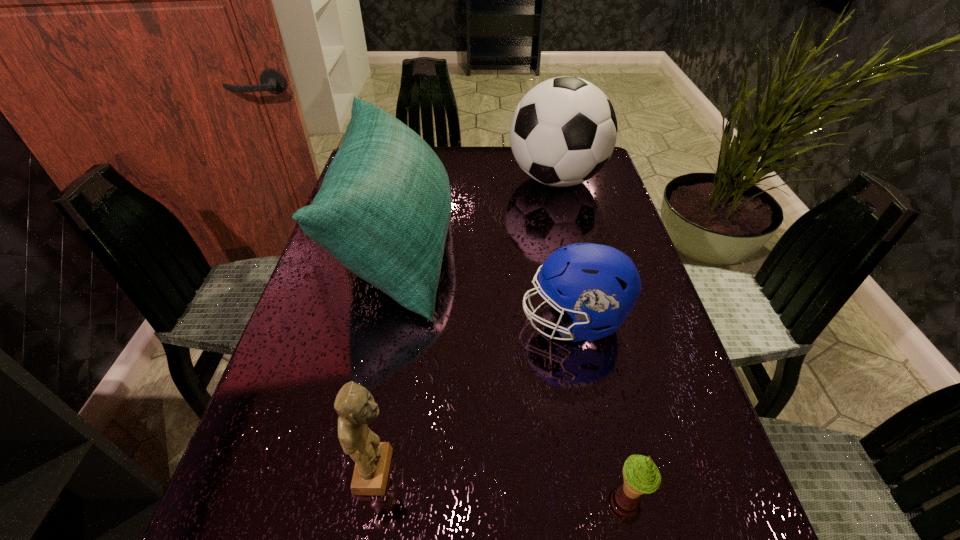
Find the location of a particular element. soccer ball is located at coordinates (x=563, y=132).

Image resolution: width=960 pixels, height=540 pixels. What are the coordinates of `cushion` in the screenshot? It's located at (383, 210).

Locate an element on the screen. figurine is located at coordinates (355, 405).

You are a GUI agent. You are given a task and a screenshot of the screen. Output one action in this format:
    pyautogui.click(x=<x>, y=<y>)
    Task: Click on the football helmet
    Image resolution: width=960 pixels, height=540 pixels.
    Given the screenshot: What is the action you would take?
    pyautogui.click(x=597, y=285)

Locate an element on the screen. icecream is located at coordinates (641, 476).

This screenshot has width=960, height=540. I want to click on vacant space located 0.280m on the left of the soccer ball, so click(x=416, y=179).

This screenshot has width=960, height=540. Find the location of `free spot located on the front-facing side of the cushion`. free spot located on the front-facing side of the cushion is located at coordinates (588, 247).

The width and height of the screenshot is (960, 540). What are the coordinates of `vacant space located 0.280m on the front-facing side of the figurine` in the screenshot? It's located at (568, 471).

Find the location of `vacant space located on the front-facing side of the football helmet`. vacant space located on the front-facing side of the football helmet is located at coordinates (362, 320).

The height and width of the screenshot is (540, 960). In order to click on free spot located 0.360m on the front-facing side of the football helmet in this screenshot , I will do `click(352, 320)`.